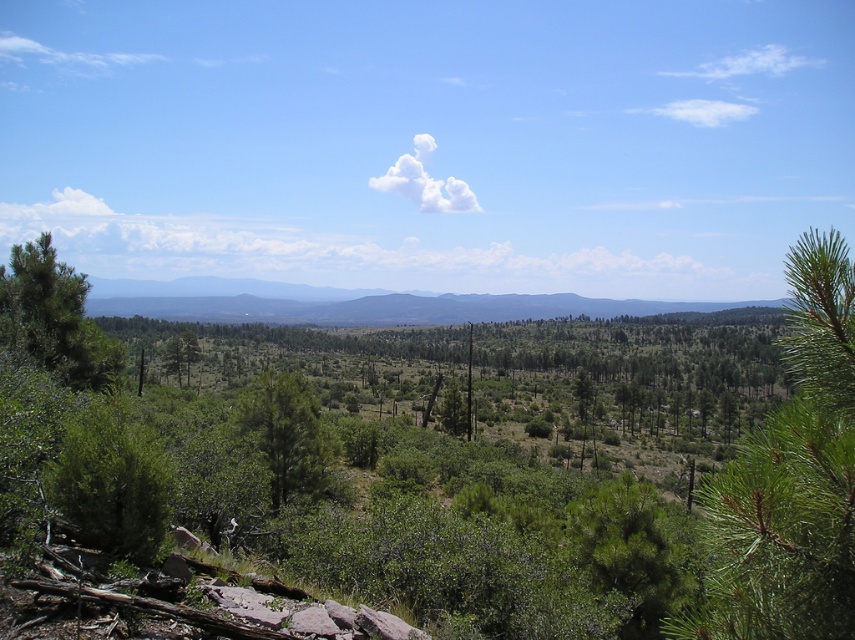
Question: Which of the following is the closest to the observer?

Choices:
 (A) (75, 352)
 (B) (313, 458)

Answer: (A)

Question: Which of the following is the farthest from the observer?

Choices:
 (A) (304, 392)
 (B) (21, 296)
 (C) (814, 596)

Answer: (A)

Question: Considering the relative positions of green matte tree at left and green matte tree at center in the image provided, where is green matte tree at left located with respect to green matte tree at center?

Choices:
 (A) above
 (B) below

Answer: (A)

Question: Can you confirm if green matte tree at left is smaller than green matte tree at center?

Choices:
 (A) yes
 (B) no

Answer: (A)

Question: Which object appears closest to the camera in this image?

Choices:
 (A) green matte tree at left
 (B) green matte tree at center

Answer: (B)

Question: Does green needle-like at upper right have a greater width compared to green matte tree at center?

Choices:
 (A) yes
 (B) no

Answer: (A)